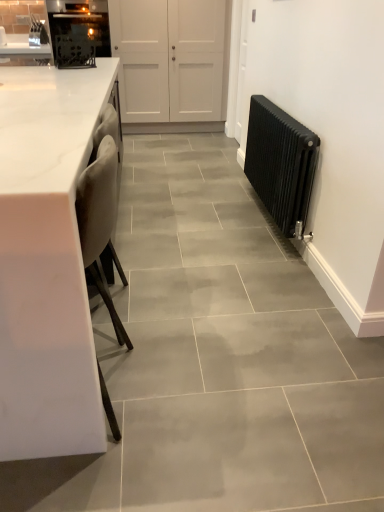
Question: Can you confirm if black matte oven at upper left is bigger than white marble countertop at left?

Choices:
 (A) no
 (B) yes

Answer: (A)

Question: Can you confirm if black matte oven at upper left is taller than white marble countertop at left?

Choices:
 (A) yes
 (B) no

Answer: (B)

Question: From the image's perspective, does black matte oven at upper left appear higher than white marble countertop at left?

Choices:
 (A) yes
 (B) no

Answer: (A)

Question: Is black matte oven at upper left not close to white marble countertop at left?

Choices:
 (A) no
 (B) yes

Answer: (B)

Question: Can you confirm if black matte oven at upper left is thinner than white marble countertop at left?

Choices:
 (A) no
 (B) yes

Answer: (B)

Question: In the image, is black matte oven at upper left positioned in front of or behind black metal radiator at right?

Choices:
 (A) front
 (B) behind

Answer: (B)

Question: From a real-world perspective, is black matte oven at upper left positioned above or below black metal radiator at right?

Choices:
 (A) above
 (B) below

Answer: (A)

Question: Is point (92, 4) positioned closer to the camera than point (264, 186)?

Choices:
 (A) closer
 (B) farther

Answer: (B)

Question: Considering the positions of black matte oven at upper left and black metal radiator at right in the image, is black matte oven at upper left taller or shorter than black metal radiator at right?

Choices:
 (A) tall
 (B) short

Answer: (A)

Question: Is white marble countertop at left bigger or smaller than black metal radiator at right?

Choices:
 (A) big
 (B) small

Answer: (A)

Question: Is white marble countertop at left inside the boundaries of black metal radiator at right, or outside?

Choices:
 (A) outside
 (B) inside

Answer: (A)

Question: From the image's perspective, is white marble countertop at left above or below black metal radiator at right?

Choices:
 (A) above
 (B) below

Answer: (B)

Question: Is white marble countertop at left taller or shorter than black metal radiator at right?

Choices:
 (A) short
 (B) tall

Answer: (B)

Question: From the image's perspective, is white marble countertop at left located above or below white matte door at upper center?

Choices:
 (A) below
 (B) above

Answer: (A)

Question: Considering the positions of white marble countertop at left and white matte door at upper center in the image, is white marble countertop at left taller or shorter than white matte door at upper center?

Choices:
 (A) tall
 (B) short

Answer: (B)